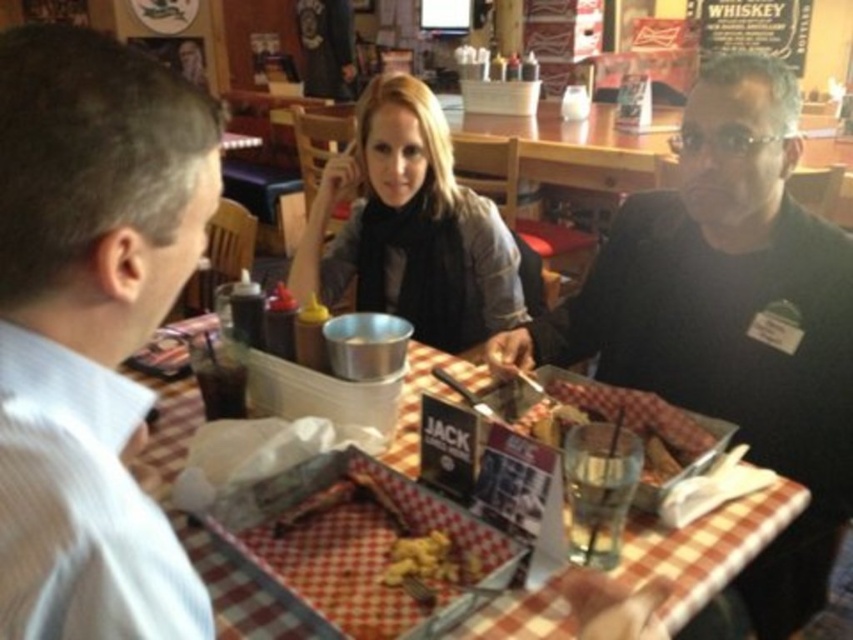
Which is more to the right, matte black scarf at center or golden crispy nuggets at center?

golden crispy nuggets at center is more to the right.

Can you confirm if matte black scarf at center is positioned to the left of golden crispy nuggets at center?

Indeed, matte black scarf at center is positioned on the left side of golden crispy nuggets at center.

Locate an element on the screen. matte black scarf at center is located at coordinates (415, 228).

Is black matte shirt at center further to the viewer compared to golden crispy nuggets at center?

Yes, it is behind golden crispy nuggets at center.

Between black matte shirt at center and golden crispy nuggets at center, which one appears on the left side from the viewer's perspective?

golden crispy nuggets at center is more to the left.

The image size is (853, 640). In order to click on black matte shirt at center in this screenshot , I will do `click(730, 316)`.

This screenshot has width=853, height=640. I want to click on black matte shirt at center, so click(x=730, y=316).

Can you confirm if white shirt at left is smaller than checkered plastic tray at center?

Yes.

Is point (44, 118) positioned before point (705, 518)?

Yes, it is in front of point (705, 518).

Locate an element on the screen. This screenshot has width=853, height=640. white shirt at left is located at coordinates (90, 326).